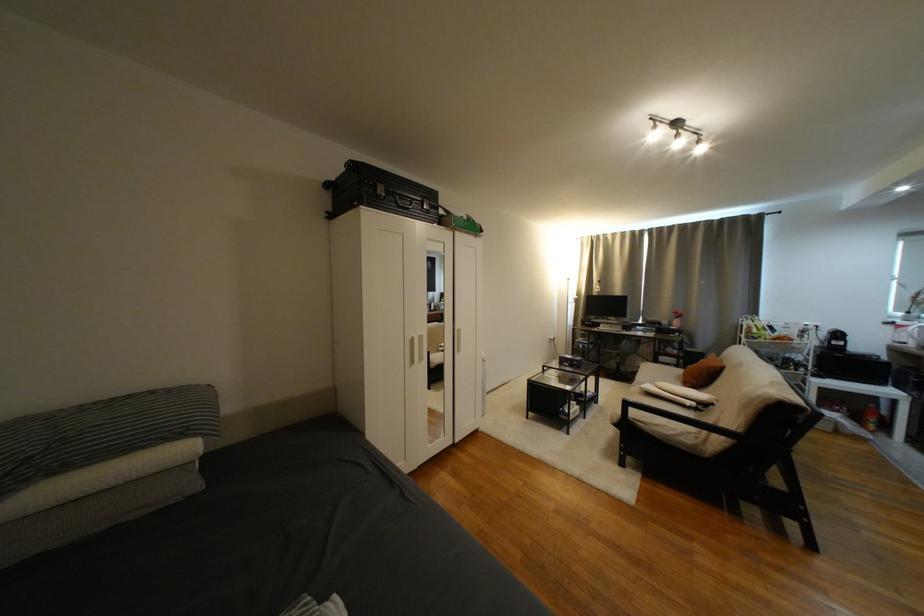
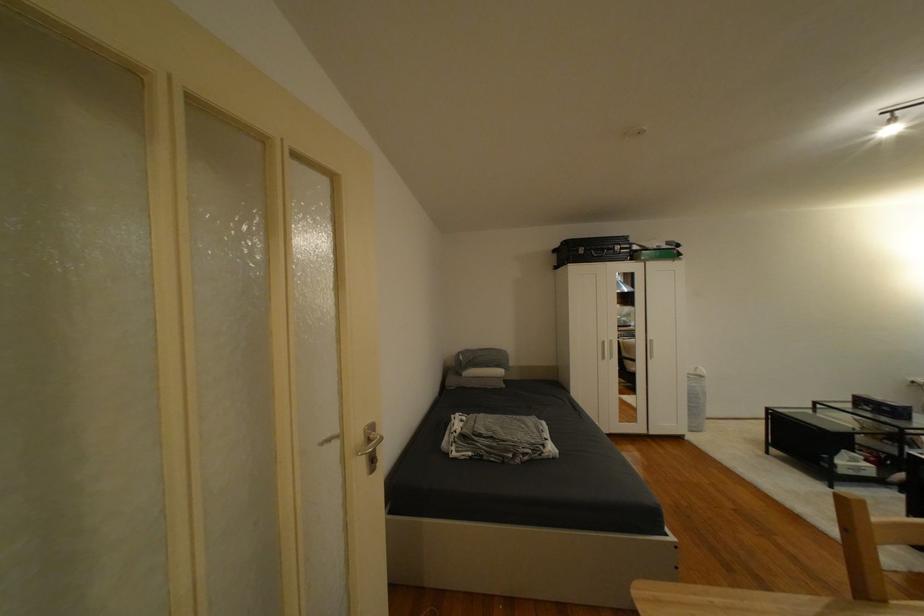
Locate, in the second image, the point that corresponds to (420,342) in the first image.

(612, 344)